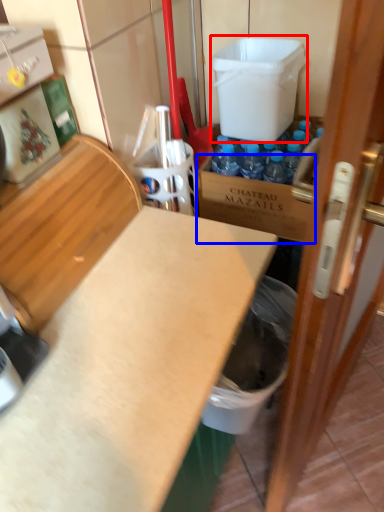
Question: Among these objects, which one is nearest to the camera, water cooler (highlighted by a red box) or cardboard box (highlighted by a blue box)?

Choices:
 (A) water cooler
 (B) cardboard box

Answer: (A)